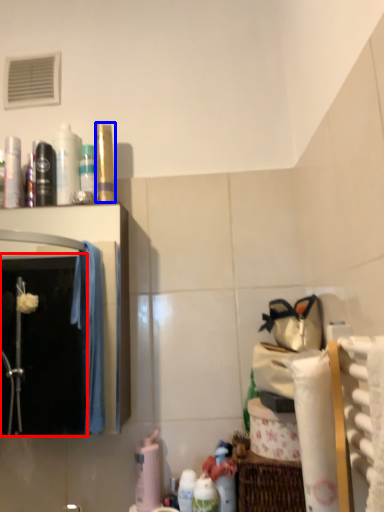
Question: Which point is closer to the camera, mirror (highlighted by a red box) or toiletry (highlighted by a blue box)?

Choices:
 (A) mirror
 (B) toiletry

Answer: (A)